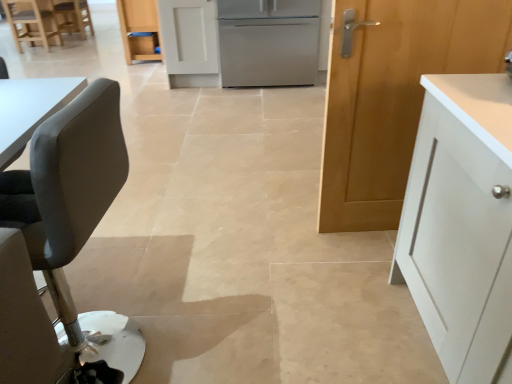
Question: Is wooden chair at upper left, the second chair positioned from the left, to the right of matte gray chair at upper left, placed as the 1th chair when sorted from left to right, from the viewer's perspective?

Choices:
 (A) yes
 (B) no

Answer: (A)

Question: Considering the relative positions of wooden chair at upper left, which is the first chair in top-to-bottom order, and matte gray chair at upper left, marked as the second chair in a front-to-back arrangement, in the image provided, is wooden chair at upper left, which is the first chair in top-to-bottom order, in front of matte gray chair at upper left, marked as the second chair in a front-to-back arrangement,?

Choices:
 (A) yes
 (B) no

Answer: (B)

Question: Considering the relative positions of wooden chair at upper left, acting as the 2th chair starting from the right, and matte gray chair at upper left, the third chair when ordered from right to left, in the image provided, is wooden chair at upper left, acting as the 2th chair starting from the right, behind matte gray chair at upper left, the third chair when ordered from right to left,?

Choices:
 (A) no
 (B) yes

Answer: (B)

Question: Can you see wooden chair at upper left, the third chair when ordered from front to back, touching matte gray chair at upper left, marked as the second chair in a front-to-back arrangement?

Choices:
 (A) no
 (B) yes

Answer: (A)

Question: Is wooden chair at upper left, acting as the 2th chair starting from the right, wider than matte gray chair at upper left, which appears as the 2th chair when viewed from the back?

Choices:
 (A) no
 (B) yes

Answer: (A)

Question: Is wooden chair at upper left, the second chair positioned from the left, smaller than matte gray chair at upper left, placed as the 1th chair when sorted from left to right?

Choices:
 (A) yes
 (B) no

Answer: (A)

Question: Is matte wood cabinet at center, which is the 2th cabinetry from front to back, thinner than matte gray chair at upper left, the third chair when ordered from right to left?

Choices:
 (A) no
 (B) yes

Answer: (B)

Question: From a real-world perspective, is matte wood cabinet at center, which appears as the 1th cabinetry when viewed from the back, physically above matte gray chair at upper left, marked as the second chair in a front-to-back arrangement?

Choices:
 (A) yes
 (B) no

Answer: (A)

Question: Considering the relative positions of matte wood cabinet at center, positioned as the 2th cabinetry in right-to-left order, and matte gray chair at upper left, positioned as the 2th chair in top-to-bottom order, in the image provided, is matte wood cabinet at center, positioned as the 2th cabinetry in right-to-left order, to the left of matte gray chair at upper left, positioned as the 2th chair in top-to-bottom order, from the viewer's perspective?

Choices:
 (A) yes
 (B) no

Answer: (B)

Question: Is matte wood cabinet at center, the 1th cabinetry from the left, oriented towards matte gray chair at upper left, the third chair when ordered from right to left?

Choices:
 (A) no
 (B) yes

Answer: (B)

Question: Is matte wood cabinet at center, which is the 2th cabinetry from front to back, bigger than matte gray chair at upper left, the third chair when ordered from right to left?

Choices:
 (A) no
 (B) yes

Answer: (B)

Question: Is matte wood cabinet at center, the second cabinetry in the bottom-to-top sequence, completely or partially outside of matte gray chair at upper left, placed as the 1th chair when sorted from left to right?

Choices:
 (A) no
 (B) yes

Answer: (B)

Question: Is matte gray chair at upper left, placed as the 1th chair when sorted from left to right, bigger than stainless steel refrigerator at center?

Choices:
 (A) no
 (B) yes

Answer: (A)